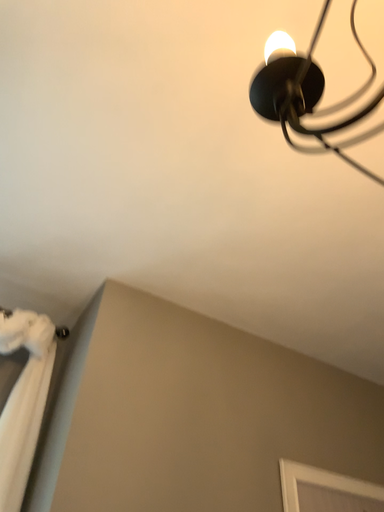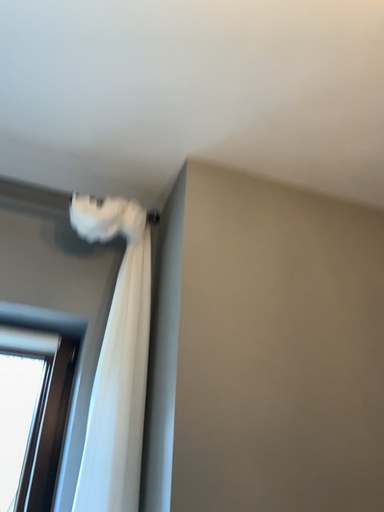
Question: Which way did the camera rotate in the video?

Choices:
 (A) rotated downward
 (B) rotated upward

Answer: (A)